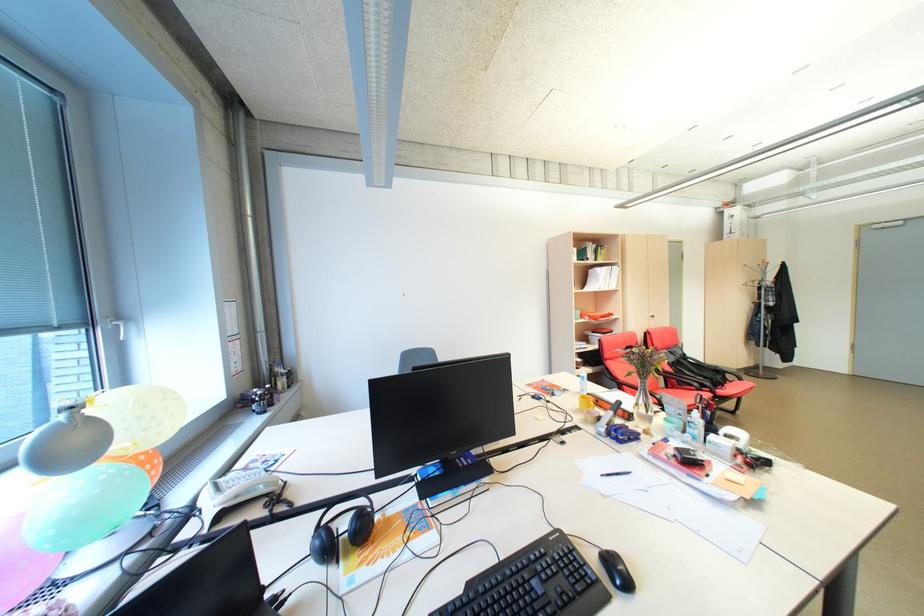
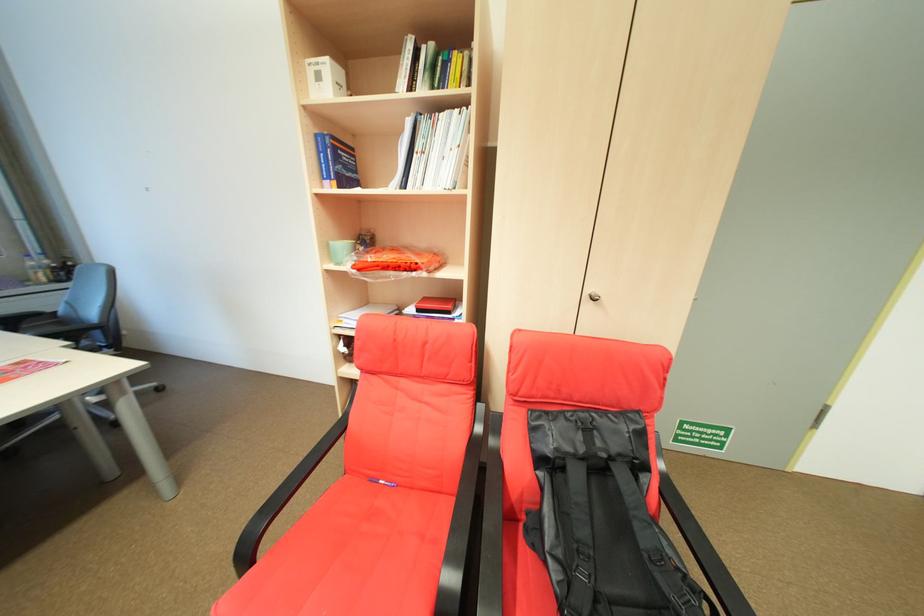
Find the pixel in the second image that matches the point at 681,365 in the first image.

(549, 461)